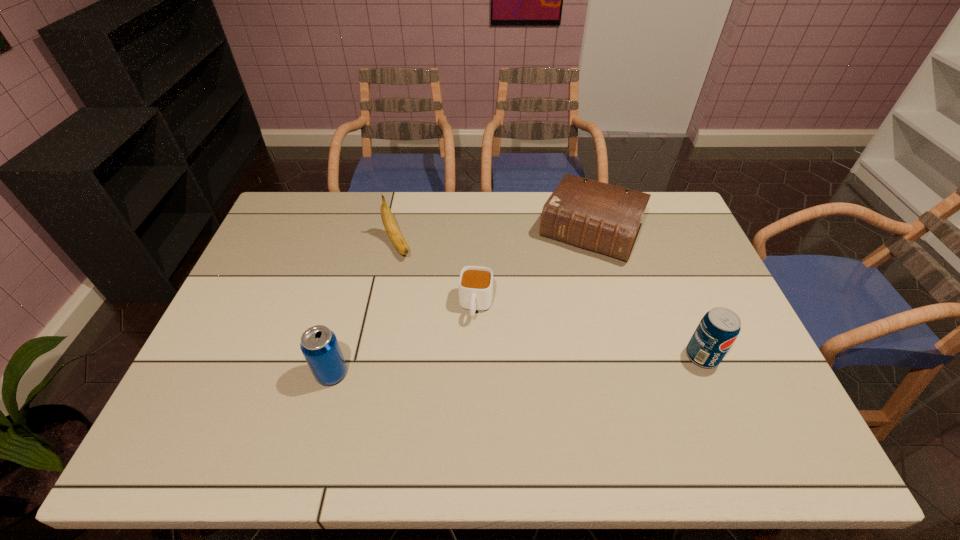
The height and width of the screenshot is (540, 960). I want to click on vacant space located 0.090m at the start of the peel on the fourth object from right to left, so point(414,278).

Identify the location of free space located 0.090m on the spine side of the Bible. Image resolution: width=960 pixels, height=540 pixels. (564, 281).

In order to click on vacant area situated on the spine side of the Bible in this screenshot , I will do click(x=556, y=296).

The width and height of the screenshot is (960, 540). What are the coordinates of `blank space located on the spine side of the Bible` in the screenshot? It's located at (534, 338).

Where is `vacant space situated 0.120m on the side with the handle of the shortest object`? vacant space situated 0.120m on the side with the handle of the shortest object is located at coordinates (468, 362).

Identify the location of vacant space situated on the side with the handle of the shortest object. (463, 396).

I want to click on vacant point located 0.220m on the side with the handle of the shortest object, so click(463, 396).

Image resolution: width=960 pixels, height=540 pixels. Find the location of `banana that is at the far edge`. banana that is at the far edge is located at coordinates (390, 225).

I want to click on Bible present at the far edge, so 596,216.

Locate an element on the screen. This screenshot has width=960, height=540. object that is at the near edge is located at coordinates (319, 345).